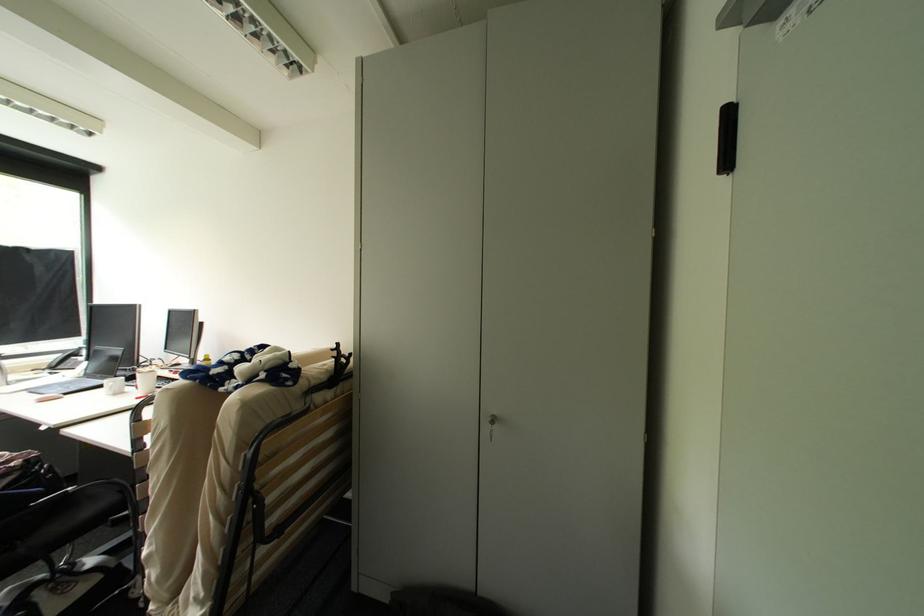
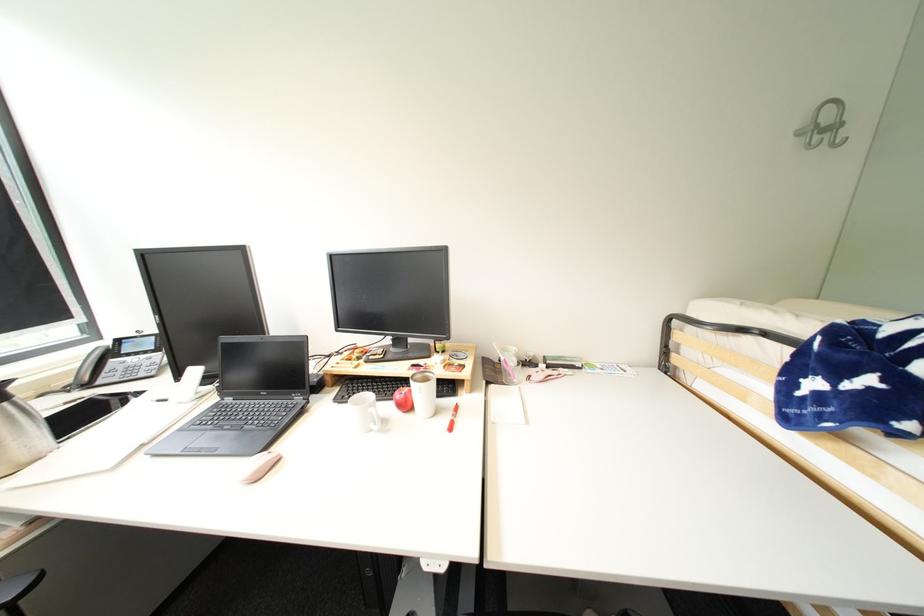
The images are taken continuously from a first-person perspective. In which direction are you moving?

The cameraman walked toward left, forward.